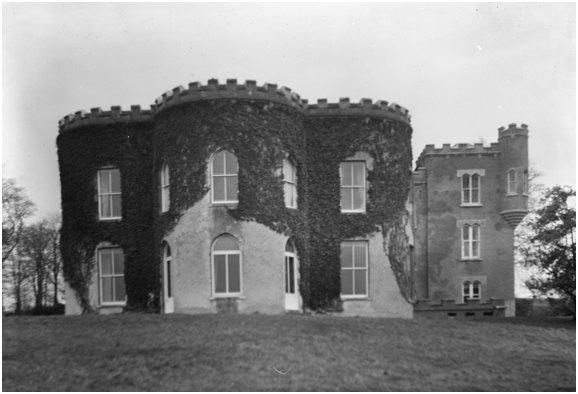
At what (x,y) coordinates should I click in order to perform the action: click on 3rd floor window. Please return your answer as a coordinate pair (x, y). Looking at the image, I should click on (473, 183).